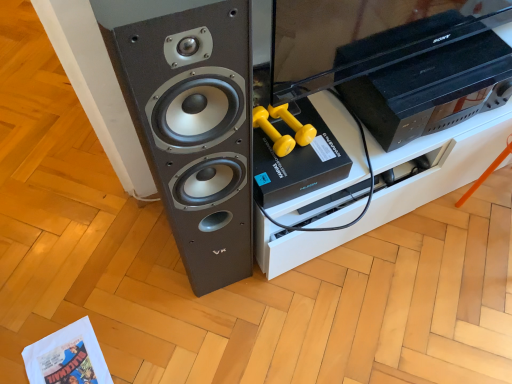
This screenshot has height=384, width=512. Find the location of `vacant region to the left of matte black speaker at left`. vacant region to the left of matte black speaker at left is located at coordinates (132, 255).